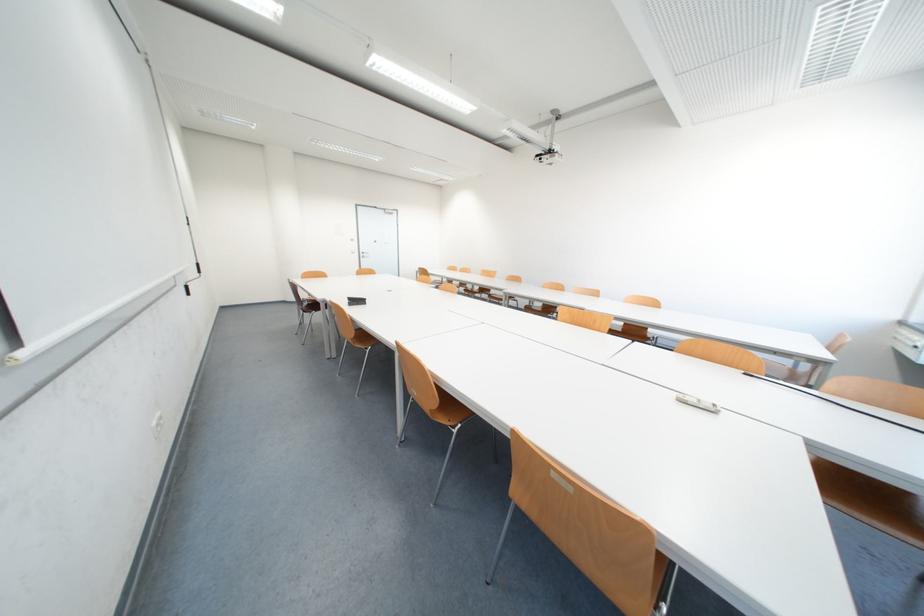
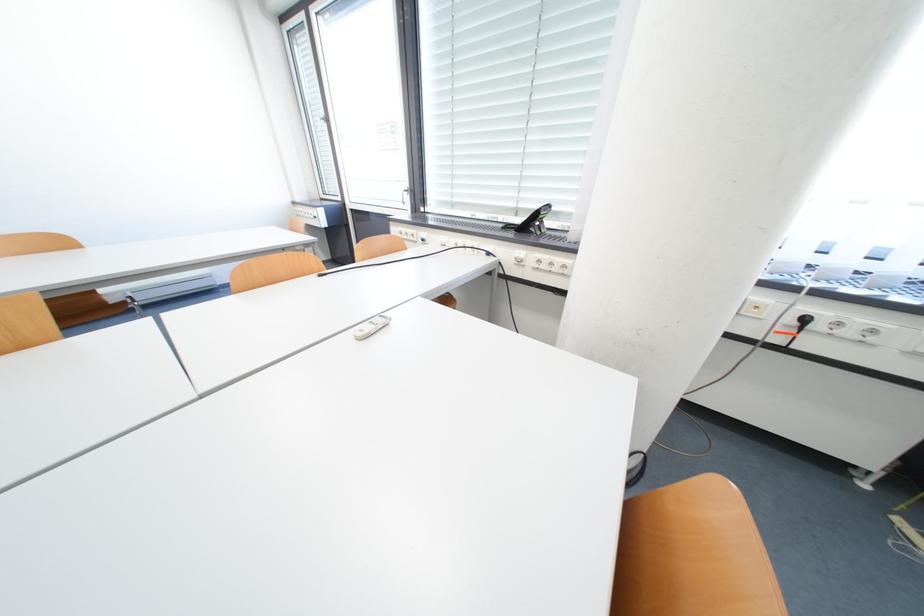
Based on the continuous images, in which direction is the camera rotating?

The rotation direction of the camera is right-down.